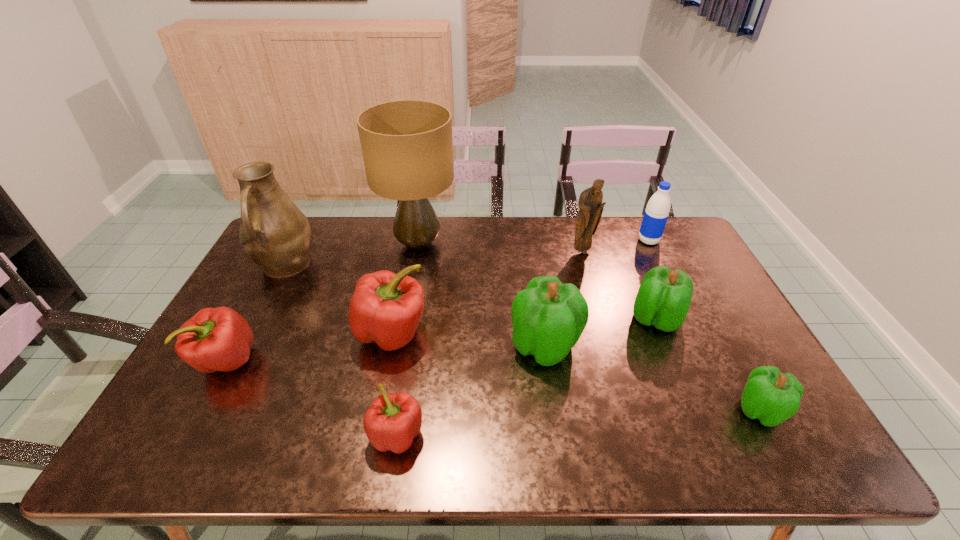
Locate an element on the screen. the tallest object is located at coordinates (407, 146).

Find the location of a particular element. The height and width of the screenshot is (540, 960). lampshade is located at coordinates (407, 146).

This screenshot has width=960, height=540. Find the location of `pitcher`. pitcher is located at coordinates (274, 233).

Locate an element on the screen. the third tallest object is located at coordinates (590, 204).

I want to click on the fourth object from right to left, so click(x=590, y=204).

What are the coordinates of `blue water bottle` in the screenshot? It's located at (657, 210).

This screenshot has width=960, height=540. I want to click on the biggest green bell pepper, so click(x=548, y=317).

Image resolution: width=960 pixels, height=540 pixels. Identify the location of the sixth object from left to right. (548, 317).

Locate an element on the screen. the biggest pink bell pepper is located at coordinates (386, 308).

At what (x,y) coordinates should I click in order to perform the action: click on the second bell pepper from right to left. Please return your answer as a coordinate pair (x, y). Image resolution: width=960 pixels, height=540 pixels. Looking at the image, I should click on (664, 296).